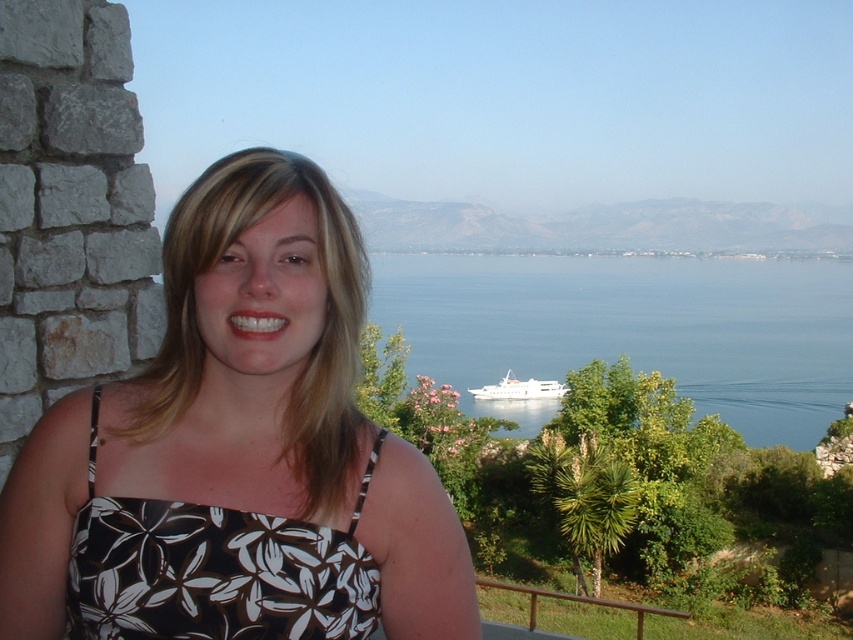
Question: Among these points, which one is nearest to the camera?

Choices:
 (A) (247, 586)
 (B) (505, 316)
 (C) (194, 211)
 (D) (564, 388)

Answer: (A)

Question: Does floral print dress at center have a lesser width compared to black floral fabric dress at left?

Choices:
 (A) no
 (B) yes

Answer: (A)

Question: Is floral print dress at center to the right of black floral fabric dress at left from the viewer's perspective?

Choices:
 (A) yes
 (B) no

Answer: (A)

Question: Is floral print dress at center in front of blue water at center?

Choices:
 (A) yes
 (B) no

Answer: (A)

Question: Which point is farther to the camera?

Choices:
 (A) [x=502, y=396]
 (B) [x=213, y=172]
 (C) [x=158, y=536]
 (D) [x=817, y=426]

Answer: (D)

Question: Among these objects, which one is farthest from the camera?

Choices:
 (A) black floral fabric dress at left
 (B) blue water at center
 (C) white glossy cruise ship at center

Answer: (C)